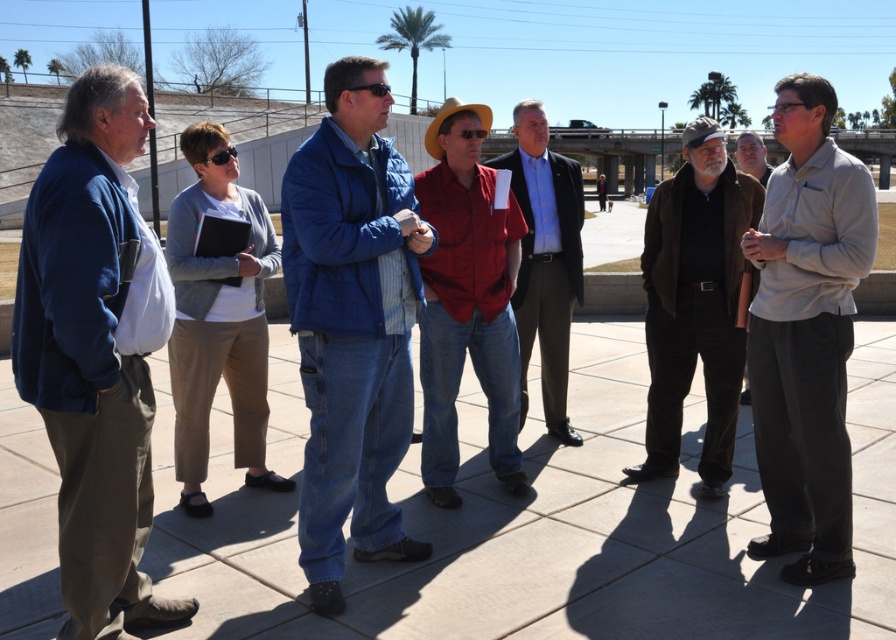
Between red denim jeans at center and dark brown leather jacket at center, which one appears on the right side from the viewer's perspective?

Answer: From the viewer's perspective, dark brown leather jacket at center appears more on the right side.

Measure the distance from red denim jeans at center to dark brown leather jacket at center.

A distance of 1.13 meters exists between red denim jeans at center and dark brown leather jacket at center.

Does point (464, 305) lie in front of point (673, 449)?

That is True.

I want to click on red denim jeans at center, so click(x=467, y=301).

Does matte blue jacket at left have a greater width compared to brown leather jacket at center?

In fact, matte blue jacket at left might be narrower than brown leather jacket at center.

Does matte blue jacket at left have a lesser height compared to brown leather jacket at center?

Yes, matte blue jacket at left is shorter than brown leather jacket at center.

Find the location of a particular element. matte blue jacket at left is located at coordinates (96, 353).

Find the location of `matte blue jacket at left`. matte blue jacket at left is located at coordinates (96, 353).

Image resolution: width=896 pixels, height=640 pixels. In order to click on gray cotton shirt at center in this screenshot , I will do `click(806, 332)`.

Is point (761, 401) more distant than point (562, 340)?

No, it is not.

At what (x,y) coordinates should I click in order to perform the action: click on gray cotton shirt at center. Please return your answer as a coordinate pair (x, y). The width and height of the screenshot is (896, 640). Looking at the image, I should click on (806, 332).